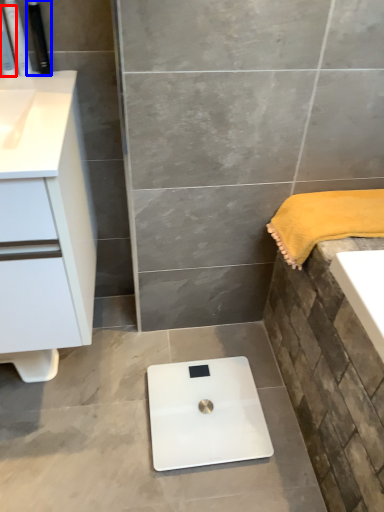
Question: Which point is further to the camera, toiletry (highlighted by a red box) or toiletry (highlighted by a blue box)?

Choices:
 (A) toiletry
 (B) toiletry

Answer: (B)